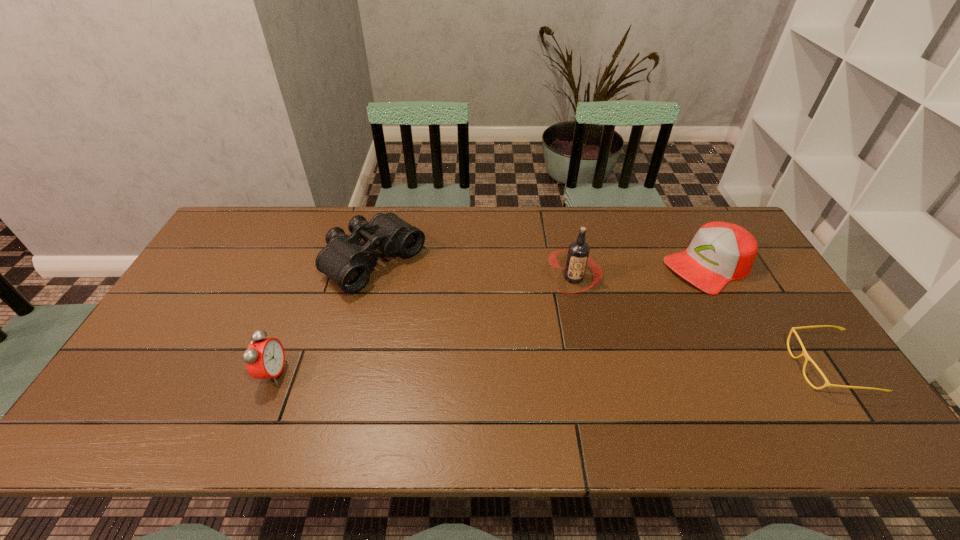
Find the location of a particular element. Image resolution: width=960 pixels, height=540 pixels. vacant space at the right edge of the desktop is located at coordinates tap(803, 364).

This screenshot has height=540, width=960. What are the coordinates of `free space at the near left corner` in the screenshot? It's located at (171, 393).

Where is `vacant space at the far right corner of the desktop`? This screenshot has width=960, height=540. vacant space at the far right corner of the desktop is located at coordinates coord(696,232).

Identify the location of free region at the near right corner. The image size is (960, 540). (821, 399).

Locate an element on the screen. unoccupied area between the alarm clock and the tallest object is located at coordinates (423, 326).

Where is `empty space between the baseball cap and the third object from left to right`? This screenshot has width=960, height=540. empty space between the baseball cap and the third object from left to right is located at coordinates (641, 272).

You are a GUI agent. You are given a task and a screenshot of the screen. Output one action in this format:
    pyautogui.click(x=<x>, y=<y>)
    Task: Click on the vacant area that lies between the third object from left to right and the alarm clock
    This screenshot has width=960, height=540.
    Given the screenshot: What is the action you would take?
    pyautogui.click(x=423, y=326)

Locate an element on the screen. The height and width of the screenshot is (540, 960). vacant area that lies between the baseball cap and the third object from right to left is located at coordinates (641, 272).

This screenshot has width=960, height=540. I want to click on vacant region between the baseball cap and the alarm clock, so click(x=491, y=320).

Where is `free space between the alarm clock and the binoculars`? The image size is (960, 540). free space between the alarm clock and the binoculars is located at coordinates (324, 318).